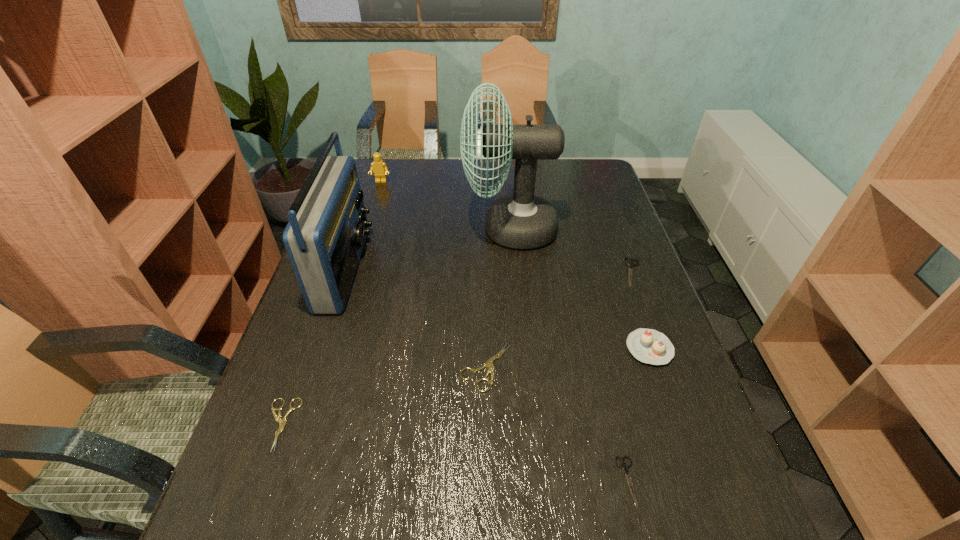
At what (x,y) coordinates should I click in order to perform the action: click on object that is at the far left corner. Please return your answer as a coordinate pair (x, y). This screenshot has height=540, width=960. Looking at the image, I should click on (378, 166).

I want to click on vacant space at the far edge, so click(436, 158).

In the image, there is a desktop. Where is `blank space at the left edge`? blank space at the left edge is located at coordinates (376, 251).

Identify the location of vacant region at the right edge of the desktop. (633, 401).

Find the location of a particular element. This screenshot has width=960, height=540. vacant region between the second shears from right to left and the third tallest object is located at coordinates (504, 331).

What are the coordinates of `vacant area that lies between the sixth shortest object and the third nearest shears` in the screenshot? It's located at (434, 274).

Identify the location of vacant region between the bigger beige shears and the cupcake. (568, 357).

You are a GUI agent. You are given a task and a screenshot of the screen. Output one action in this format:
    pyautogui.click(x=<x>, y=<y>)
    Task: Click on the vacant area that lies between the rightmost shears and the cupcake
    
    Given the screenshot: What is the action you would take?
    pyautogui.click(x=641, y=310)

Locate an element on the screen. free space between the second tallest object and the rightmost shears is located at coordinates (490, 270).

You are a GUI agent. You are given a task and a screenshot of the screen. Output one action in this format:
    pyautogui.click(x=<x>, y=<y>)
    Task: Click on the free spot between the fourth tallest object and the seventh shortest object
    The image size is (960, 540).
    Given the screenshot: What is the action you would take?
    pyautogui.click(x=497, y=308)